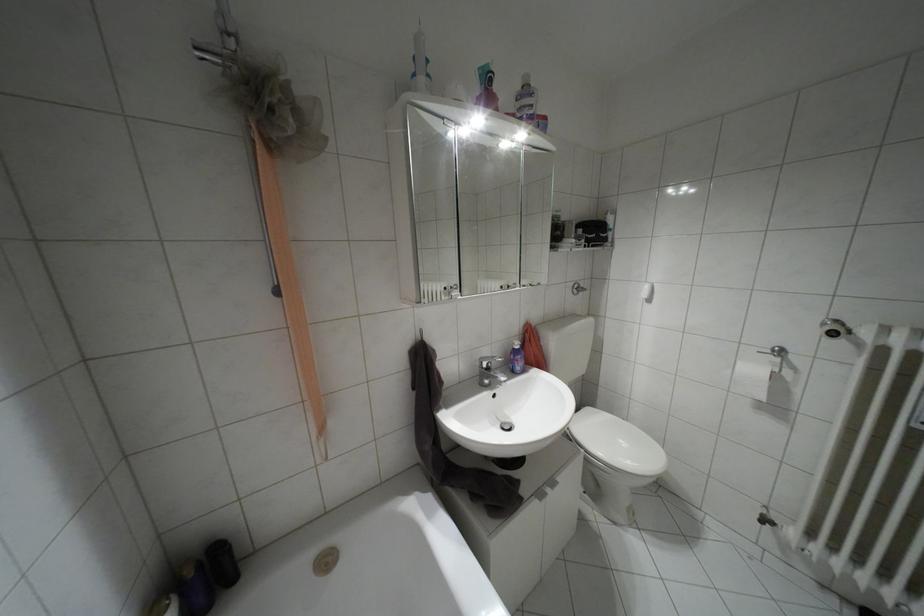
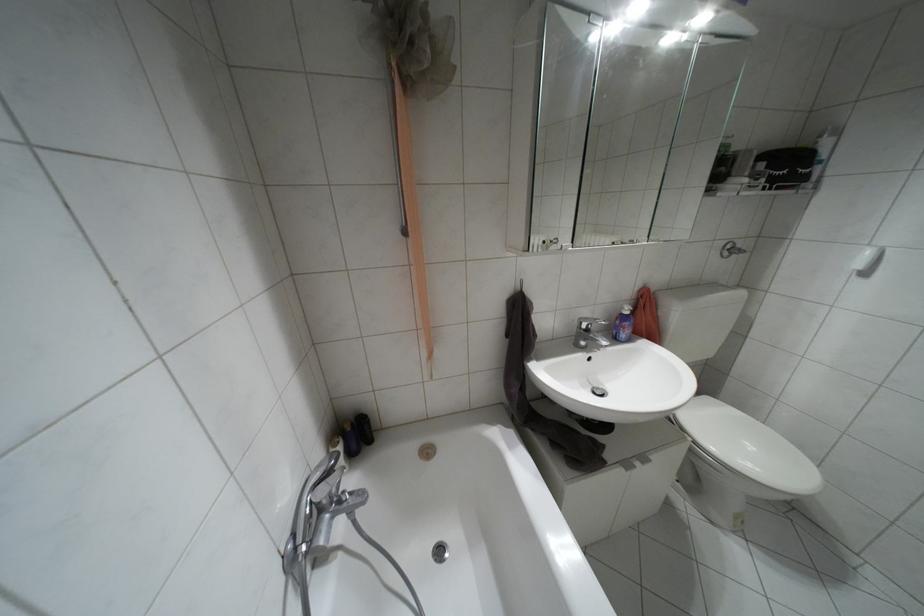
Where in the second image is the point corresponding to point (233, 578) from the first image?

(370, 440)